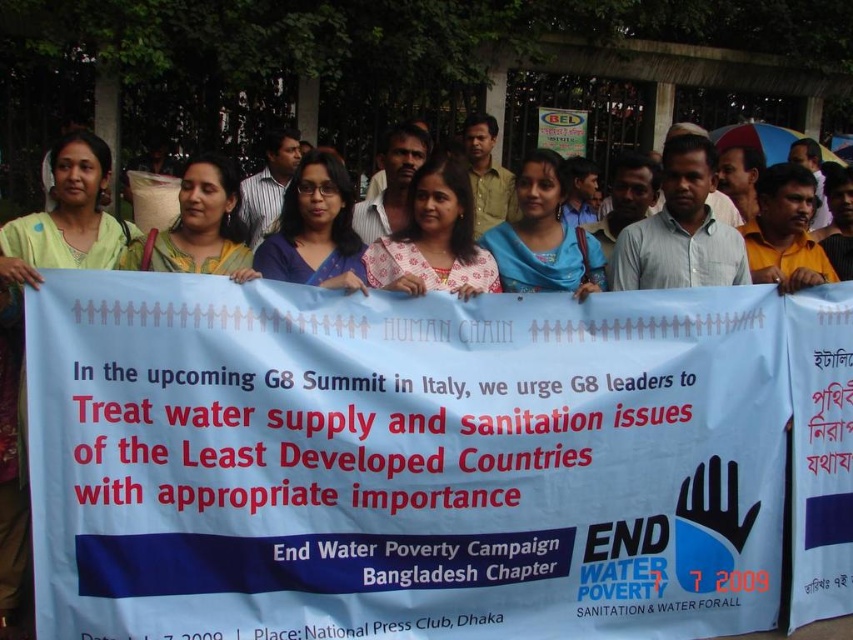
Who is shorter, white paper banner at center or blue fabric banner at center?

Standing shorter between the two is blue fabric banner at center.

Does white paper banner at center have a lesser height compared to blue fabric banner at center?

In fact, white paper banner at center may be taller than blue fabric banner at center.

Where is `white paper banner at center`? This screenshot has width=853, height=640. white paper banner at center is located at coordinates (401, 461).